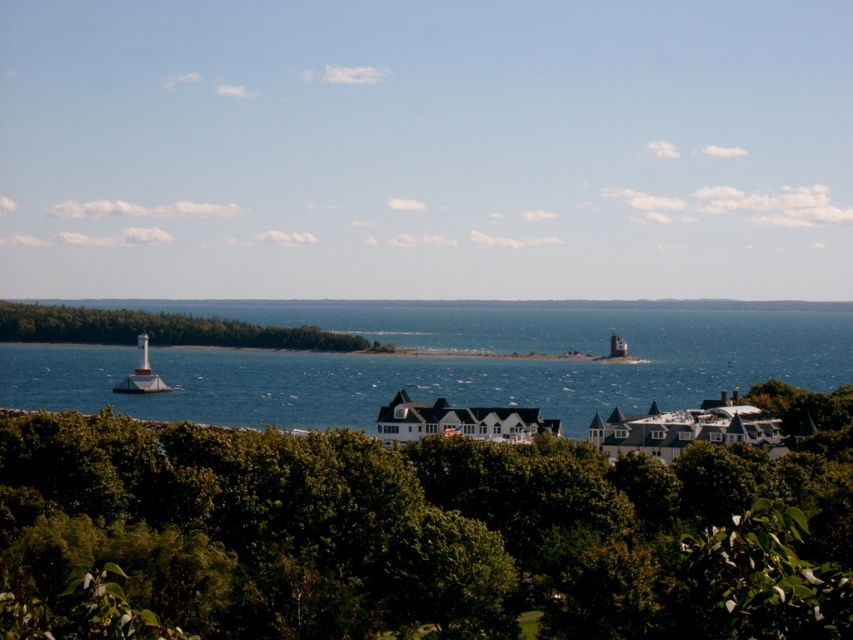
Does green leafy tree at left appear under white painted wood lighthouse at left?

No, green leafy tree at left is not below white painted wood lighthouse at left.

Locate an element on the screen. The height and width of the screenshot is (640, 853). green leafy tree at left is located at coordinates (161, 330).

Identify the location of green leafy tree at left. (161, 330).

Is point (463, 502) positioned behind point (132, 392)?

No, it is in front of (132, 392).

Which is above, green leafy tree at lower center or white painted wood lighthouse at left?

green leafy tree at lower center is higher up.

What do you see at coordinates (432, 531) in the screenshot? I see `green leafy tree at lower center` at bounding box center [432, 531].

Find the location of a particular element. The height and width of the screenshot is (640, 853). green leafy tree at lower center is located at coordinates (432, 531).

Does blue water at center have a smaller size compared to green leafy tree at left?

No, blue water at center is not smaller than green leafy tree at left.

Between point (287, 419) and point (12, 310), which one is positioned in front?

Point (287, 419) is in front.

You are a GUI agent. You are given a task and a screenshot of the screen. Output one action in this format:
    pyautogui.click(x=<x>, y=<y>)
    Task: Click on the blue water at center
    The image size is (853, 640).
    Given the screenshot: What is the action you would take?
    pyautogui.click(x=440, y=362)